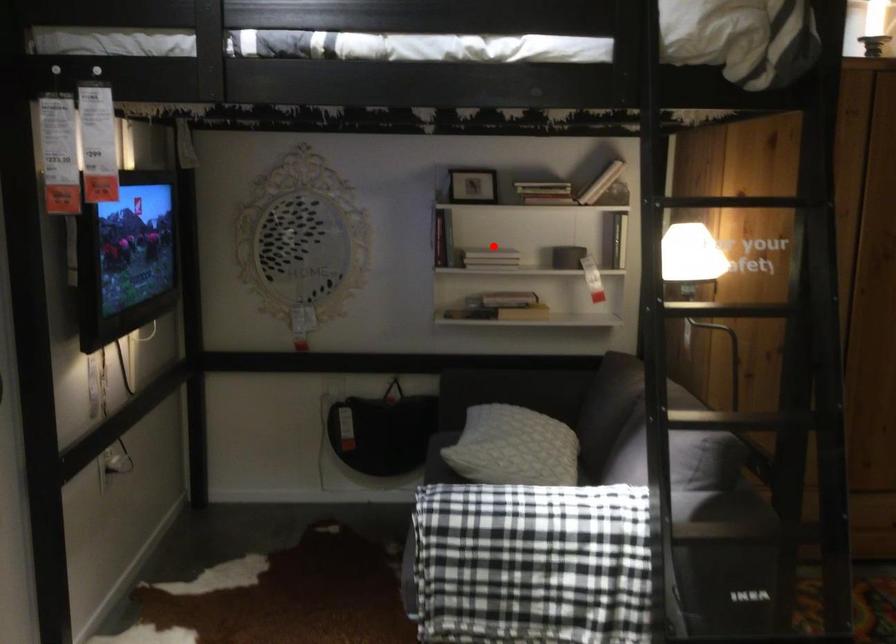
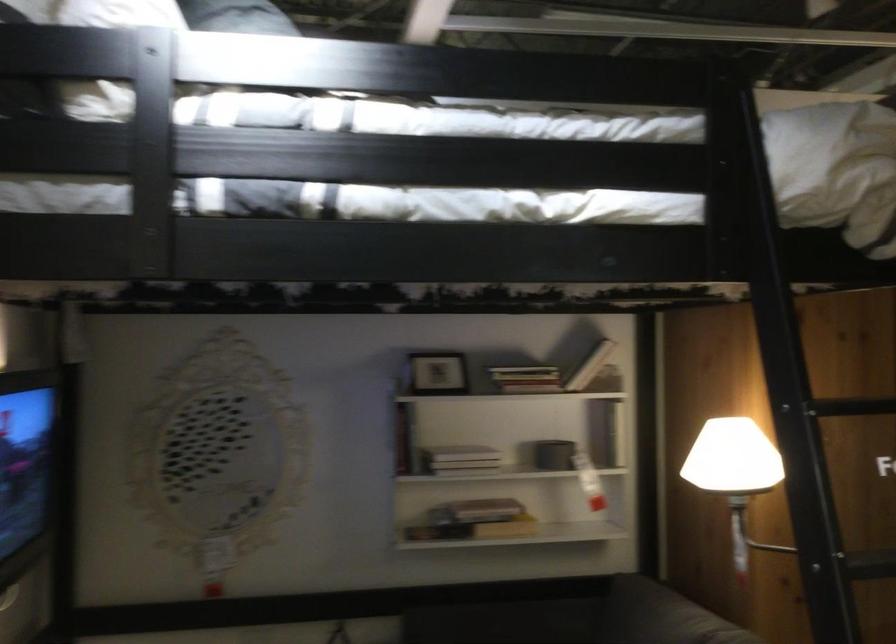
Locate, in the second image, the point that corresponds to the highlighted location in the first image.

(460, 453)